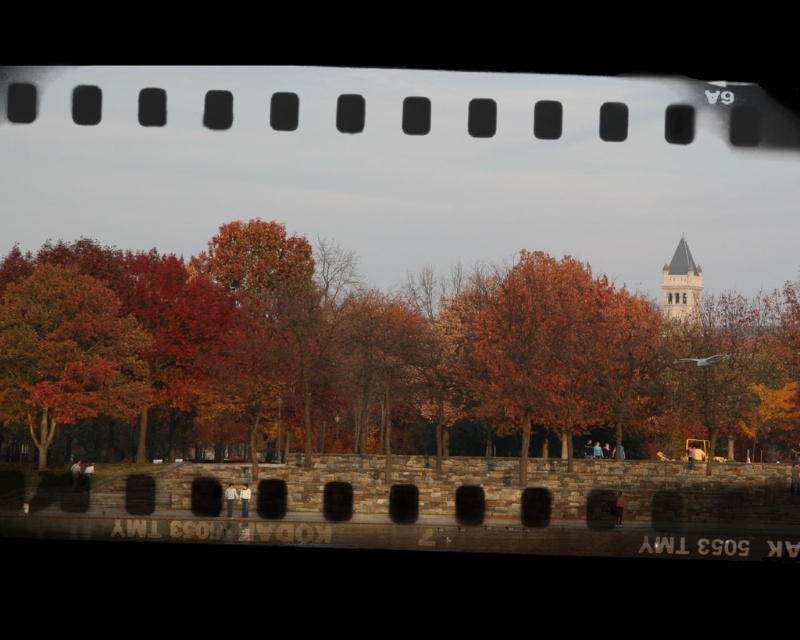
You are an archivist examining a historical film strip. You notice the autumn leaves at center and the smooth white stone bell tower at upper right. Based on their positions, which object is closer to the bottom edge of the film strip?

The autumn leaves at center is located below the smooth white stone bell tower at upper right, so the autumn leaves at center is closer to the bottom edge of the film strip.

You are an archivist examining a historical film strip. You see autumn leaves at center and a smooth white stone bell tower at upper right. Which object is located to the left of the other?

The autumn leaves at center is positioned on the left side of smooth white stone bell tower at upper right.